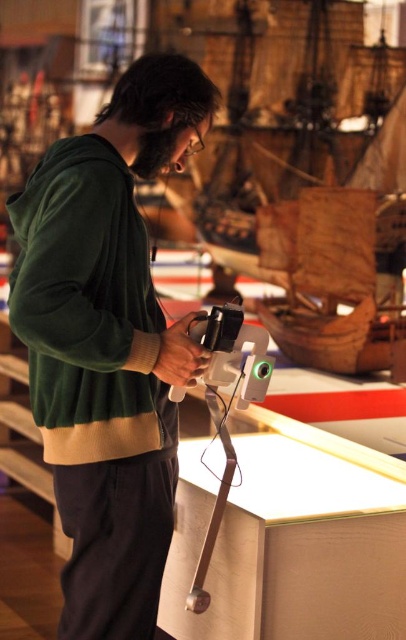
Does green velvety sweatshirt at left appear on the left side of matte black video camera at center?

Indeed, green velvety sweatshirt at left is positioned on the left side of matte black video camera at center.

Does green velvety sweatshirt at left come in front of matte black video camera at center?

Yes, it is in front of matte black video camera at center.

In order to click on green velvety sweatshirt at left in this screenshot , I will do `click(88, 307)`.

The width and height of the screenshot is (406, 640). Find the location of `green velvety sweatshirt at left`. green velvety sweatshirt at left is located at coordinates (88, 307).

From the picture: Is green soft sweater at center wider than matte black video camera at center?

Indeed, green soft sweater at center has a greater width compared to matte black video camera at center.

From the picture: Who is more distant from viewer, [99,518] or [259,356]?

Positioned behind is point [259,356].

This screenshot has height=640, width=406. In order to click on green soft sweater at center in this screenshot , I will do `click(107, 342)`.

Between point (92, 580) and point (99, 180), which one is positioned in front?

Point (99, 180) is more forward.

Which is more to the right, green soft sweater at center or green velvety sweatshirt at left?

From the viewer's perspective, green soft sweater at center appears more on the right side.

Between point (105, 406) and point (49, 388), which one is positioned in front?

Point (105, 406) is in front.

Locate an element on the screen. The height and width of the screenshot is (640, 406). green soft sweater at center is located at coordinates (107, 342).